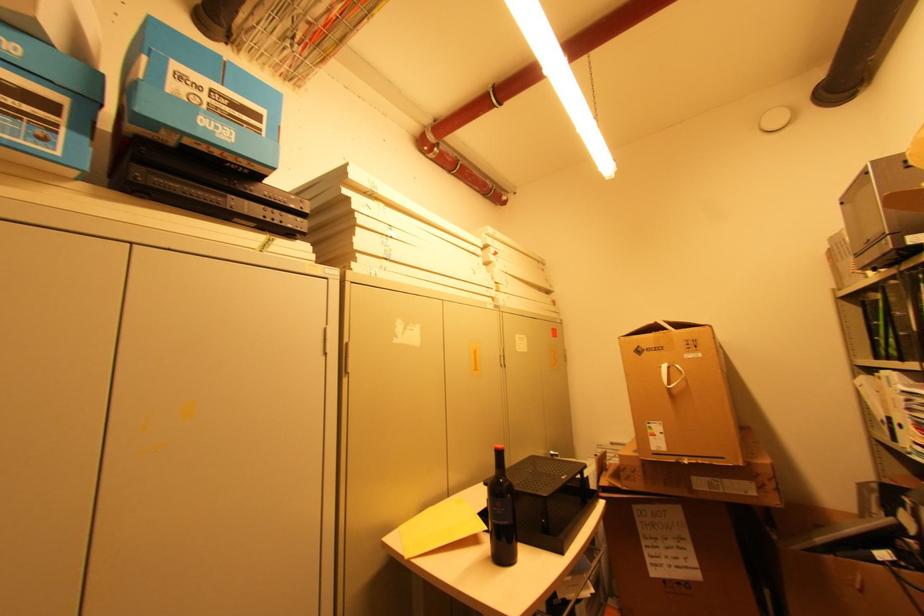
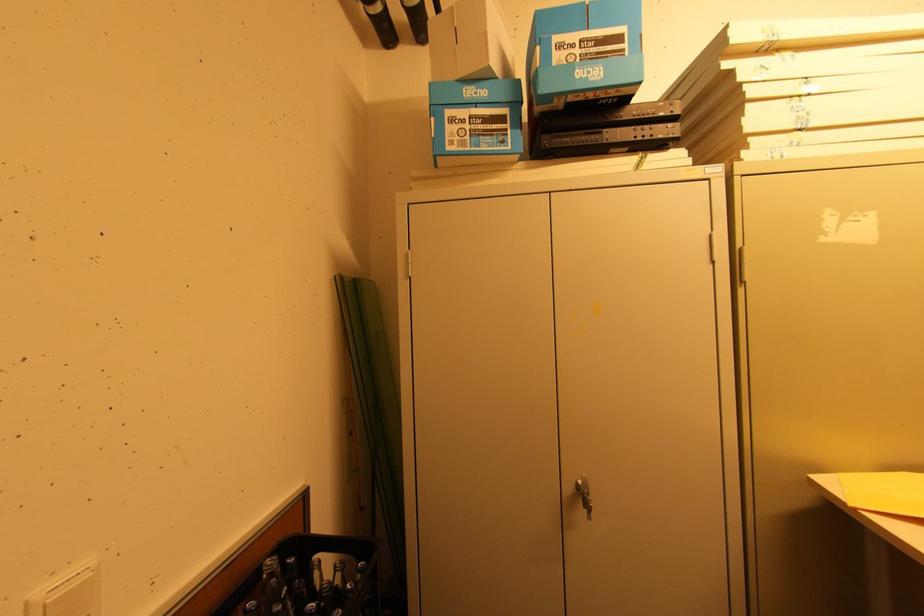
In the second image, find the point that corresponds to (76,129) in the first image.

(515, 129)